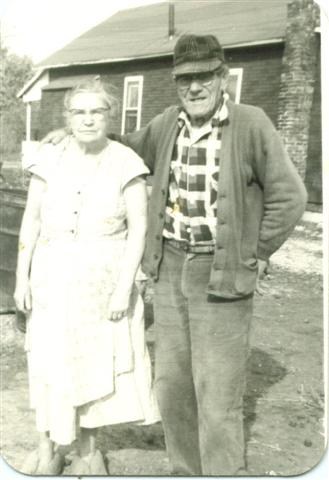
The width and height of the screenshot is (329, 480). Identify the location of slippers. (52, 466), (82, 465), (96, 466), (35, 460).